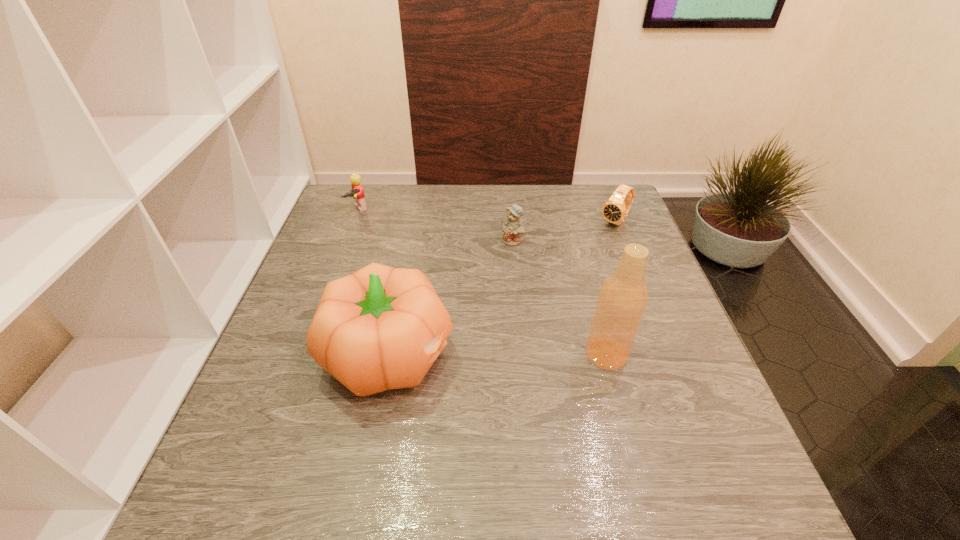
Find the location of a particular element. free space located 0.380m on the front-facing side of the teddy bear is located at coordinates (500, 357).

You are a GUI agent. You are given a task and a screenshot of the screen. Output one action in this format:
    pyautogui.click(x=<x>, y=<y>)
    Task: Click on the vacant space located 0.360m on the front-facing side of the teddy bear
    
    Given the screenshot: What is the action you would take?
    pyautogui.click(x=501, y=349)

Locate an element on the screen. The image size is (960, 540). vacant area situated on the front-facing side of the teddy bear is located at coordinates (506, 306).

Find the location of a particular element. The image size is (960, 540). free space located 0.320m in front of the Lego with the accessory visible is located at coordinates (417, 275).

At what (x,y) coordinates should I click in order to perform the action: click on vacant point located in front of the Lego with the accessory visible. Please return your answer as a coordinate pair (x, y). Looking at the image, I should click on pos(396,253).

This screenshot has height=540, width=960. In order to click on free region located in front of the Lego with the accessory visible in this screenshot , I will do `click(376, 234)`.

Where is `vacant position located 0.330m on the face of the rightmost object`? Image resolution: width=960 pixels, height=540 pixels. vacant position located 0.330m on the face of the rightmost object is located at coordinates (548, 295).

This screenshot has height=540, width=960. Identify the location of vacant space positioned on the face of the rightmost object. (548, 295).

Identify the location of vacant area situated 0.120m on the face of the rightmost object. (588, 252).

Image resolution: width=960 pixels, height=540 pixels. Find the location of `Lego at the far edge`. Lego at the far edge is located at coordinates (357, 193).